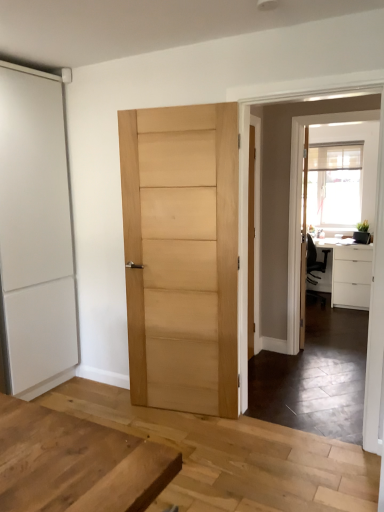
The height and width of the screenshot is (512, 384). Find the location of `vacant space situated above clear glass screen door at upper right (from a real-world perspective)`. vacant space situated above clear glass screen door at upper right (from a real-world perspective) is located at coordinates (321, 113).